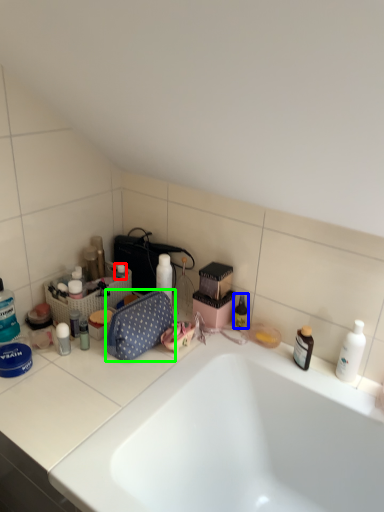
Question: Considering the real-world distances, which object is closest to toiletry (highlighted by a red box)? toiletry (highlighted by a blue box) or bag (highlighted by a green box).

Choices:
 (A) toiletry
 (B) bag

Answer: (B)